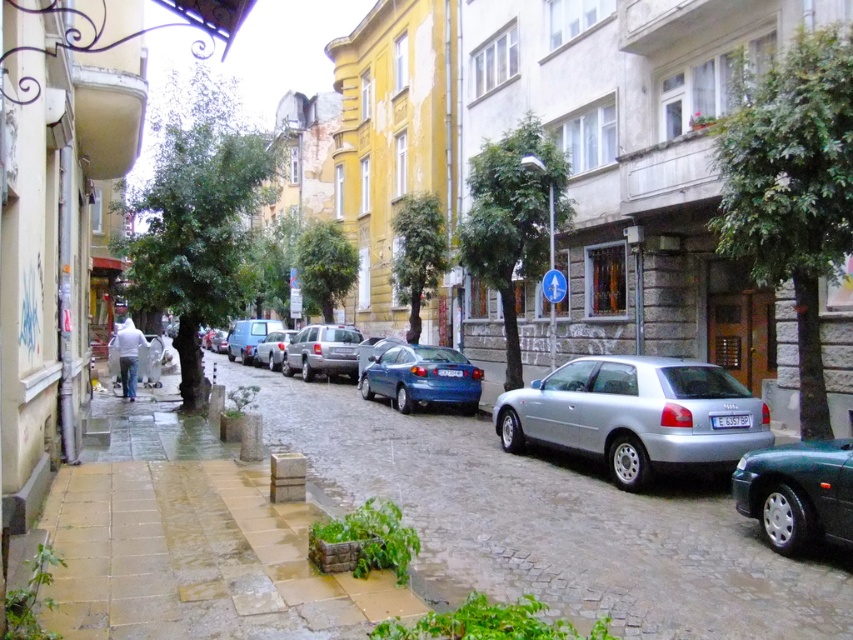
Describe the element at coordinates (322, 352) in the screenshot. The height and width of the screenshot is (640, 853). I see `satin silver suv at center` at that location.

Does satin silver suv at center appear over silver metallic hatchback at center?

No.

Is point (285, 368) positioned behind point (254, 358)?

No, (285, 368) is in front of (254, 358).

Locate an element on the screen. The height and width of the screenshot is (640, 853). satin silver suv at center is located at coordinates (322, 352).

Is brown stone pavement at center above silver metallic hatchback at center?

Actually, brown stone pavement at center is below silver metallic hatchback at center.

Does brown stone pavement at center have a lesser height compared to silver metallic hatchback at center?

Yes, brown stone pavement at center is shorter than silver metallic hatchback at center.

Between point (421, 432) and point (260, 358), which one is positioned in front?

Point (421, 432)

Identify the location of brown stone pavement at center. (550, 522).

Is brown stone pavement at center further to the viewer compared to satin silver suv at center?

No, it is in front of satin silver suv at center.

Who is more distant from viewer, (508, 467) or (294, 353)?

The point (294, 353) is behind.

What do you see at coordinates (550, 522) in the screenshot?
I see `brown stone pavement at center` at bounding box center [550, 522].

Identify the location of brown stone pavement at center. (550, 522).